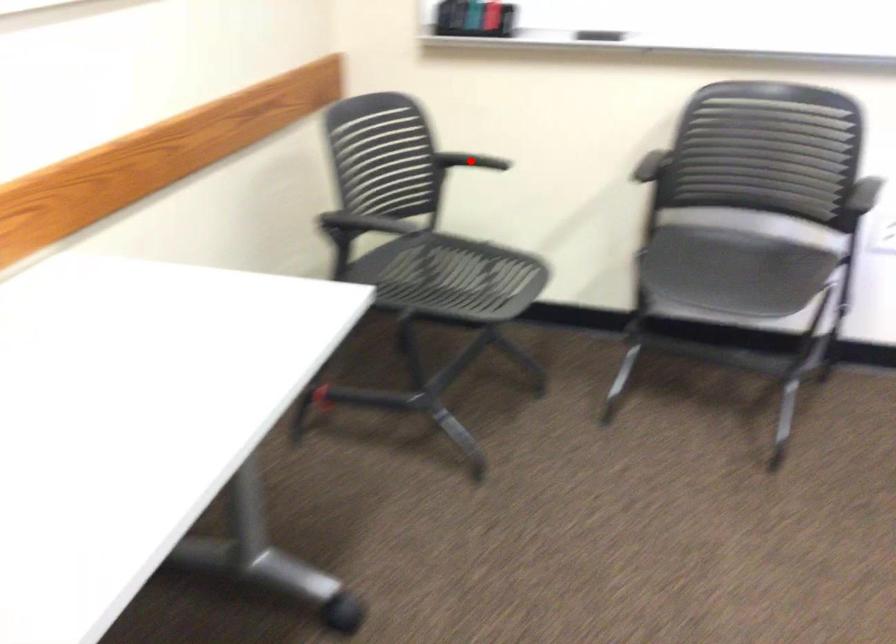
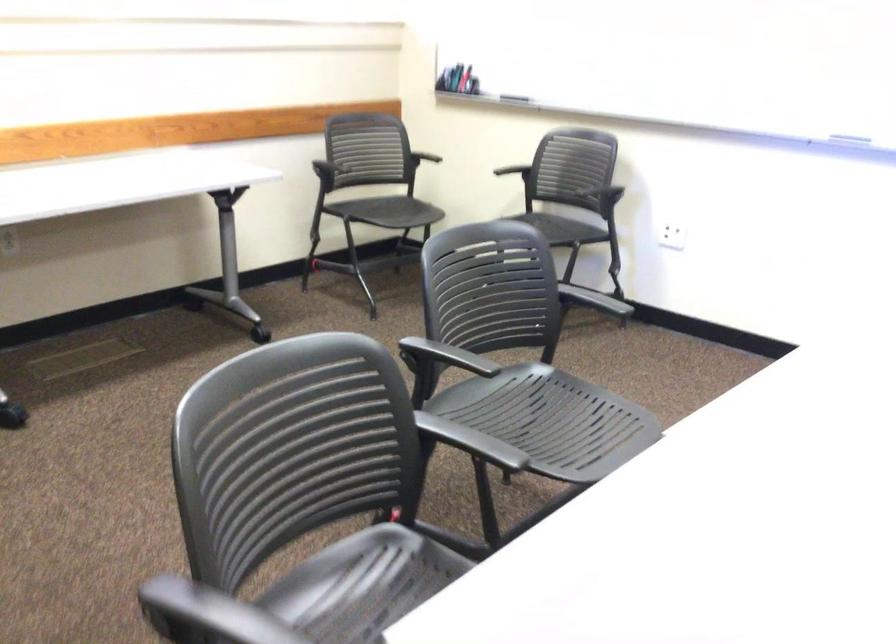
Question: I am providing you with two images of the same scene from different viewpoints. Image1 has a red point marked. In image2, the corresponding 3D location appears at what relative position? Reply with the corresponding letter.

Choices:
 (A) Closer
 (B) Farther

Answer: (B)